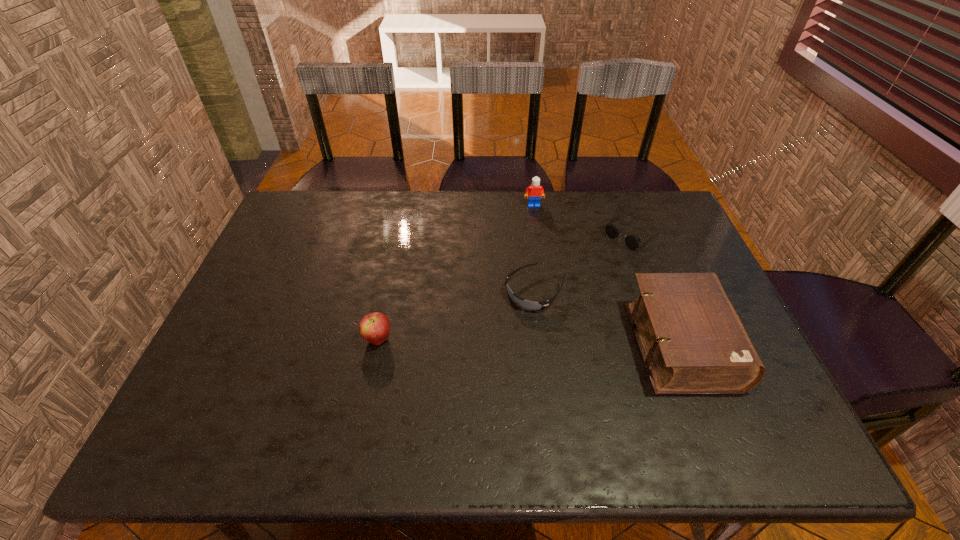
Identify the location of vacant region located on the face of the farthest object. This screenshot has height=540, width=960. (541, 244).

What are the coordinates of `free space located 0.140m on the front-facing side of the fourth nearest object` in the screenshot? It's located at (587, 269).

You are a GUI agent. You are given a task and a screenshot of the screen. Output one action in this format:
    pyautogui.click(x=<x>, y=<y>)
    Task: Click on the vacant region located 0.260m on the front-facing side of the fourth nearest object
    
    Given the screenshot: What is the action you would take?
    pyautogui.click(x=561, y=289)

Locate an element on the screen. Image resolution: width=960 pixels, height=540 pixels. free point located 0.140m on the front-facing side of the fourth nearest object is located at coordinates (587, 269).

Where is `vacant region located on the lenses of the left sunglasses`? vacant region located on the lenses of the left sunglasses is located at coordinates (492, 334).

Identify the location of vacant point located on the lenses of the left sunglasses. (474, 352).

Find the location of a particular element. vacant space positioned 0.100m on the lenses of the left sunglasses is located at coordinates click(494, 332).

The width and height of the screenshot is (960, 540). Find the location of `Lego that is at the far edge`. Lego that is at the far edge is located at coordinates (535, 191).

This screenshot has width=960, height=540. Find the location of `sunglasses that is at the far edge`. sunglasses that is at the far edge is located at coordinates (632, 241).

What are the coordinates of `object at the near edge` in the screenshot? It's located at (692, 341).